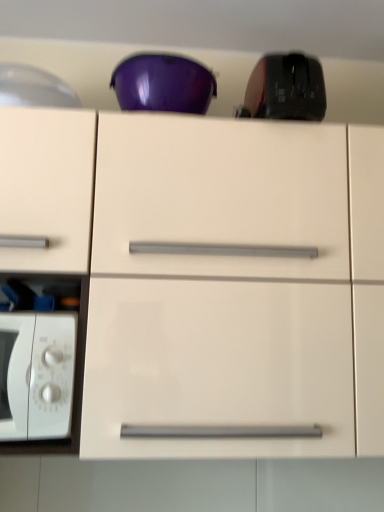
At what (x,y) coordinates should I click in order to perform the action: click on black matte mouse at upper right. Please return your answer as a coordinate pair (x, y). The width and height of the screenshot is (384, 512). Looking at the image, I should click on (286, 89).

The width and height of the screenshot is (384, 512). What do you see at coordinates (37, 375) in the screenshot?
I see `white glossy microwave oven at left` at bounding box center [37, 375].

You are a GUI agent. You are given a task and a screenshot of the screen. Output one action in this format:
    pyautogui.click(x=<x>, y=<y>)
    Task: Click on the black matte mouse at upper right
    This screenshot has height=512, width=384.
    Given the screenshot: What is the action you would take?
    pyautogui.click(x=286, y=89)

Considering the relative sizes of white glossy microwave oven at left and black matte mouse at upper right in the image provided, is white glossy microwave oven at left smaller than black matte mouse at upper right?

Incorrect, white glossy microwave oven at left is not smaller in size than black matte mouse at upper right.

Which of these two, white glossy microwave oven at left or black matte mouse at upper right, is thinner?

black matte mouse at upper right.

In the scene shown: Considering the positions of objects white glossy microwave oven at left and black matte mouse at upper right in the image provided, who is more to the right, white glossy microwave oven at left or black matte mouse at upper right?

Positioned to the right is black matte mouse at upper right.

Is white glossy microwave oven at left positioned beyond the bounds of black matte mouse at upper right?

Absolutely, white glossy microwave oven at left is external to black matte mouse at upper right.

Identify the location of cabinetry in front of the white glossy microwave oven at left. Image resolution: width=384 pixels, height=512 pixels. tap(209, 275).

From a real-world perspective, which is physically below, glossy white cabinet at center or white glossy microwave oven at left?

In real-world perspective, white glossy microwave oven at left is lower.

Can you confirm if glossy white cabinet at center is wider than white glossy microwave oven at left?

Yes.

Which object is further away from the camera, glossy white cabinet at center or white glossy microwave oven at left?

white glossy microwave oven at left.

In terms of size, does black matte mouse at upper right appear bigger or smaller than white glossy microwave oven at left?

Clearly, black matte mouse at upper right is smaller in size than white glossy microwave oven at left.

Is black matte mouse at upper right oriented away from white glossy microwave oven at left?

No, black matte mouse at upper right's orientation is not away from white glossy microwave oven at left.

Looking at their sizes, would you say black matte mouse at upper right is wider or thinner than white glossy microwave oven at left?

In the image, black matte mouse at upper right appears to be more narrow than white glossy microwave oven at left.

You are a GUI agent. You are given a task and a screenshot of the screen. Output one action in this format:
    pyautogui.click(x=<x>, y=<y>)
    Task: Click on the microwave oven that appears on the left of glossy white cabinet at center
    
    Given the screenshot: What is the action you would take?
    pyautogui.click(x=37, y=375)

Is white glossy microwave oven at left directly adjacent to glossy white cabinet at center?

No, white glossy microwave oven at left is not next to glossy white cabinet at center.

Does white glossy microwave oven at left come in front of glossy white cabinet at center?

No, the depth of white glossy microwave oven at left is greater than that of glossy white cabinet at center.

Considering the points (38, 406) and (180, 247), which point is in front, point (38, 406) or point (180, 247)?

The point (38, 406) is closer.

Is black matte mouse at upper right oriented towards glossy white cabinet at center?

No, black matte mouse at upper right does not turn towards glossy white cabinet at center.

Between black matte mouse at upper right and glossy white cabinet at center, which one has larger size?

With larger size is glossy white cabinet at center.

Is black matte mouse at upper right positioned behind glossy white cabinet at center?

Yes, the depth of black matte mouse at upper right is greater than that of glossy white cabinet at center.

Can you confirm if glossy white cabinet at center is positioned to the left of black matte mouse at upper right?

Yes, glossy white cabinet at center is to the left of black matte mouse at upper right.

Can you tell me how much glossy white cabinet at center and black matte mouse at upper right differ in facing direction?

The facing directions of glossy white cabinet at center and black matte mouse at upper right are 0.935 degrees apart.

Between point (318, 274) and point (305, 105), which one is positioned behind?

The point (305, 105) is behind.

Considering the sizes of objects glossy white cabinet at center and black matte mouse at upper right in the image provided, who is taller, glossy white cabinet at center or black matte mouse at upper right?

glossy white cabinet at center is taller.

Where is `microwave oven in front of the black matte mouse at upper right`? microwave oven in front of the black matte mouse at upper right is located at coordinates (37, 375).

Image resolution: width=384 pixels, height=512 pixels. Find the location of `cabinetry on the right of white glossy microwave oven at left`. cabinetry on the right of white glossy microwave oven at left is located at coordinates (209, 275).

Considering their positions, is black matte mouse at upper right positioned closer to white glossy microwave oven at left than glossy white cabinet at center?

Among the two, glossy white cabinet at center is located nearer to white glossy microwave oven at left.

When comparing their distances from black matte mouse at upper right, does white glossy microwave oven at left or glossy white cabinet at center seem further?

white glossy microwave oven at left.

Considering their positions, is black matte mouse at upper right positioned closer to glossy white cabinet at center than white glossy microwave oven at left?

white glossy microwave oven at left is positioned closer to the anchor glossy white cabinet at center.

From the image, which object appears to be nearer to white glossy microwave oven at left, glossy white cabinet at center or black matte mouse at upper right?

Based on the image, glossy white cabinet at center appears to be nearer to white glossy microwave oven at left.

Considering their positions, is white glossy microwave oven at left positioned closer to glossy white cabinet at center than black matte mouse at upper right?

white glossy microwave oven at left.

Based on their spatial positions, is glossy white cabinet at center or white glossy microwave oven at left closer to black matte mouse at upper right?

glossy white cabinet at center.

This screenshot has height=512, width=384. Find the location of `cabinetry between black matte mouse at upper right and white glossy microwave oven at left vertically`. cabinetry between black matte mouse at upper right and white glossy microwave oven at left vertically is located at coordinates (209, 275).